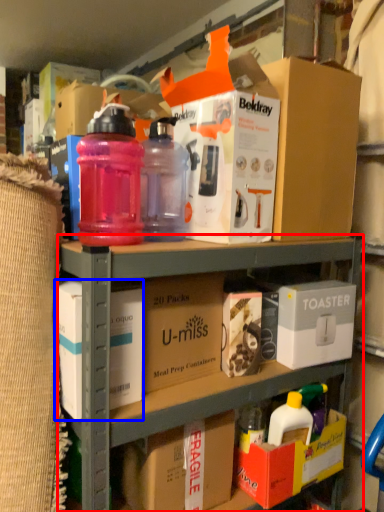
Question: Which of the following is the closest to the observer, shelf (highlighted by a red box) or box (highlighted by a blue box)?

Choices:
 (A) shelf
 (B) box

Answer: (A)